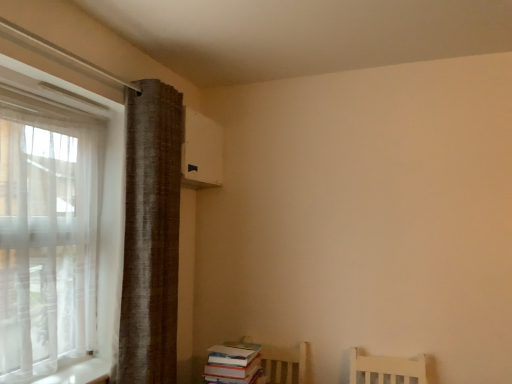
Question: Are brown textured curtain at left and hardcover books at lower right located far from each other?

Choices:
 (A) yes
 (B) no

Answer: (B)

Question: Is brown textured curtain at left outside hardcover books at lower right?

Choices:
 (A) no
 (B) yes

Answer: (B)

Question: Considering the relative sizes of brown textured curtain at left and hardcover books at lower right in the image provided, is brown textured curtain at left taller than hardcover books at lower right?

Choices:
 (A) yes
 (B) no

Answer: (A)

Question: Is brown textured curtain at left shorter than hardcover books at lower right?

Choices:
 (A) yes
 (B) no

Answer: (B)

Question: From the image's perspective, is brown textured curtain at left above hardcover books at lower right?

Choices:
 (A) yes
 (B) no

Answer: (A)

Question: From a real-world perspective, is brown textured curtain at left physically below hardcover books at lower right?

Choices:
 (A) yes
 (B) no

Answer: (B)

Question: Can we say hardcover books at lower right lies outside brown textured curtain at left?

Choices:
 (A) yes
 (B) no

Answer: (A)

Question: Is hardcover books at lower right further to the viewer compared to brown textured curtain at left?

Choices:
 (A) yes
 (B) no

Answer: (A)

Question: Is hardcover books at lower right turned away from brown textured curtain at left?

Choices:
 (A) no
 (B) yes

Answer: (A)

Question: Is the surface of hardcover books at lower right in direct contact with brown textured curtain at left?

Choices:
 (A) no
 (B) yes

Answer: (A)

Question: From a real-world perspective, does hardcover books at lower right stand above brown textured curtain at left?

Choices:
 (A) no
 (B) yes

Answer: (A)

Question: Is hardcover books at lower right not near brown textured curtain at left?

Choices:
 (A) no
 (B) yes

Answer: (A)

Question: From a real-world perspective, is hardcover books at lower right above or below brown textured curtain at left?

Choices:
 (A) above
 (B) below

Answer: (B)